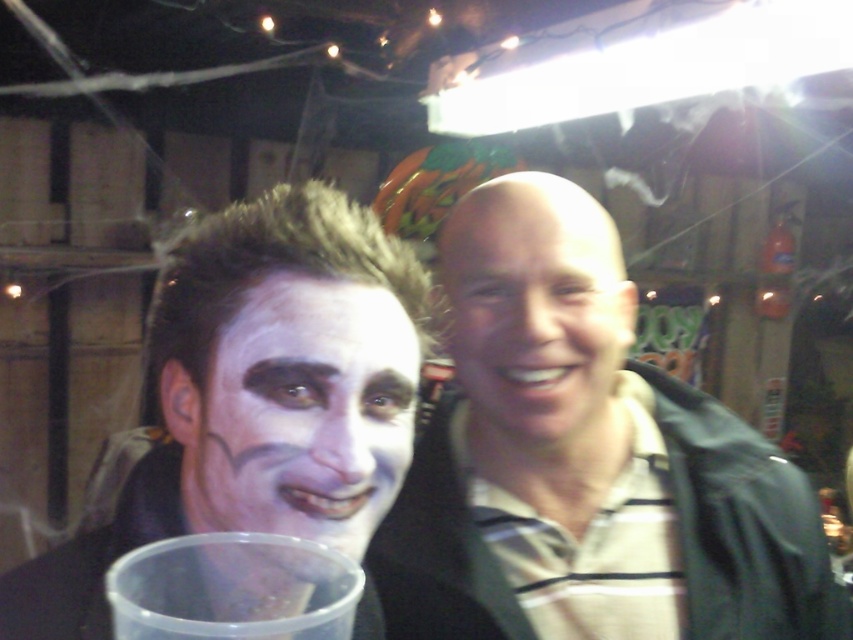
Is white matte face paint at center below white matte face at center?

Correct, white matte face paint at center is located below white matte face at center.

Locate an element on the screen. The image size is (853, 640). white matte face paint at center is located at coordinates (257, 397).

Find the location of a particular element. This screenshot has height=640, width=853. white matte face paint at center is located at coordinates (257, 397).

Does white matte face paint at center have a lesser height compared to smooth skin face at center?

No.

The image size is (853, 640). What do you see at coordinates (257, 397) in the screenshot?
I see `white matte face paint at center` at bounding box center [257, 397].

Where is `white matte face paint at center`? The width and height of the screenshot is (853, 640). white matte face paint at center is located at coordinates (257, 397).

In the scene shown: Does white matte face at center come in front of smooth skin face at center?

Yes.

Between white matte face at center and smooth skin face at center, which one has more height?

With more height is smooth skin face at center.

Where is `white matte face at center`? The height and width of the screenshot is (640, 853). white matte face at center is located at coordinates (305, 413).